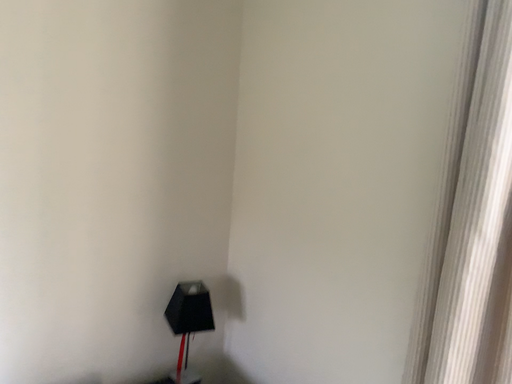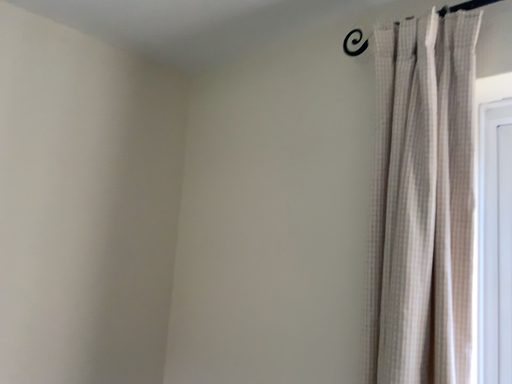
Question: How did the camera likely rotate when shooting the video?

Choices:
 (A) rotated downward
 (B) rotated upward

Answer: (B)